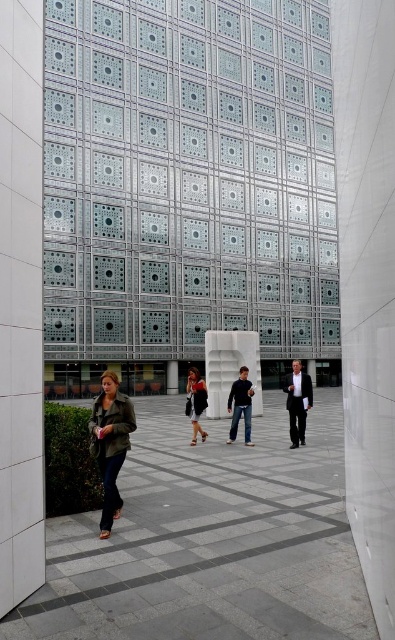
You are standing on the paved walkway leading to the building and want to reach the white marble pillar at center. According to the image, in which direction should you walk to approach the pillar?

The white marble pillar at center is located at point (231, 368), so you should walk towards the center of the walkway to reach it.